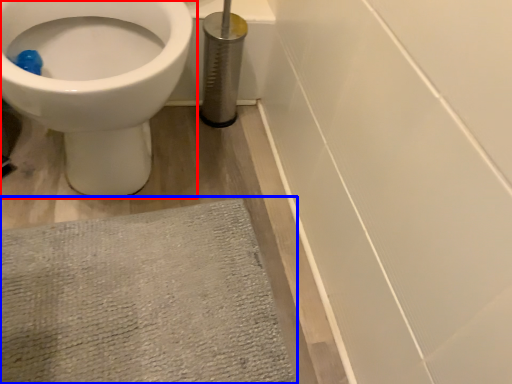
Question: Among these objects, which one is nearest to the camera, toilet (highlighted by a red box) or bath mat (highlighted by a blue box)?

Choices:
 (A) toilet
 (B) bath mat

Answer: (A)